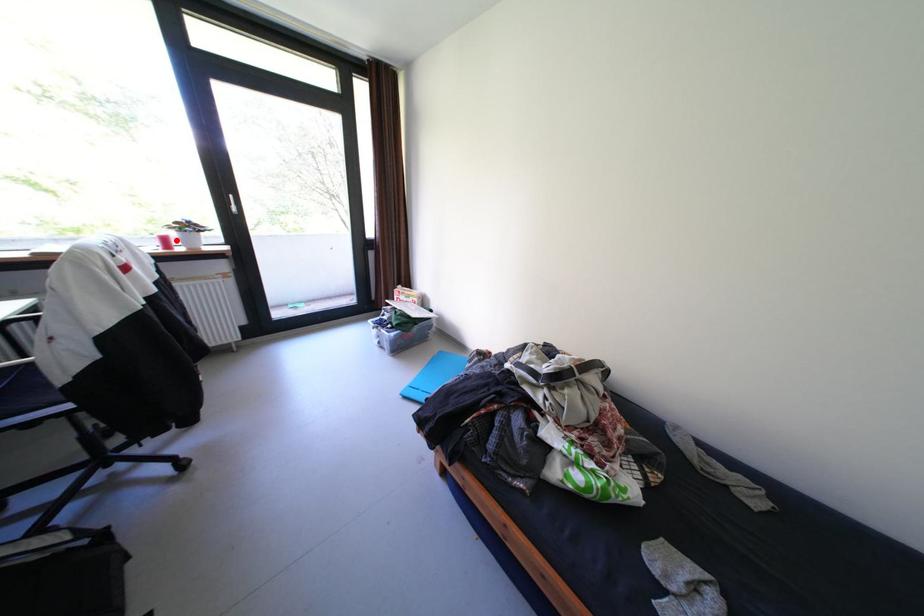
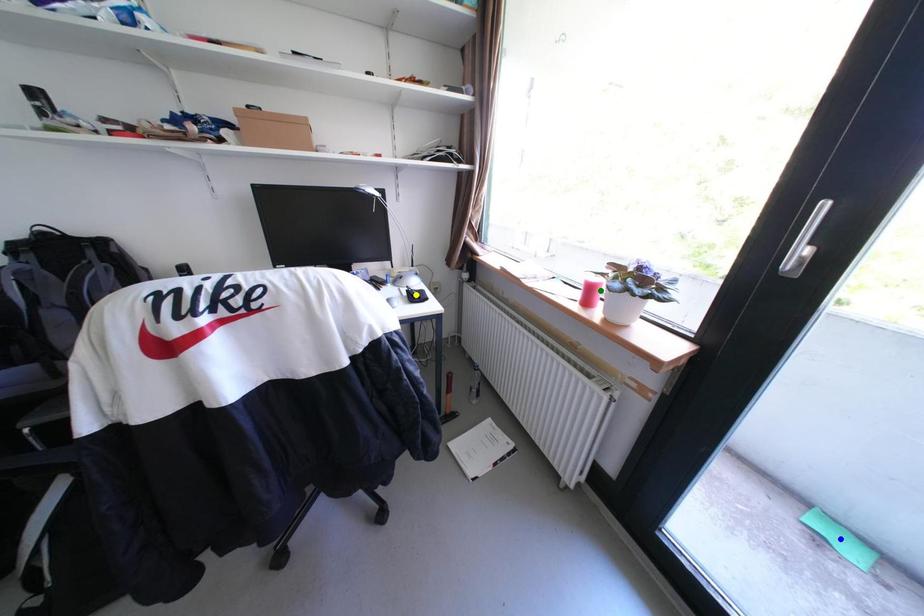
Question: I am providing you with two images of the same scene from different viewpoints. A red point is marked on the first image. You are given multiple points on the second image. Can you choose the point in image 2 that corresponds to the point in image 1?

Choices:
 (A) blue point
 (B) yellow point
 (C) green point

Answer: (C)